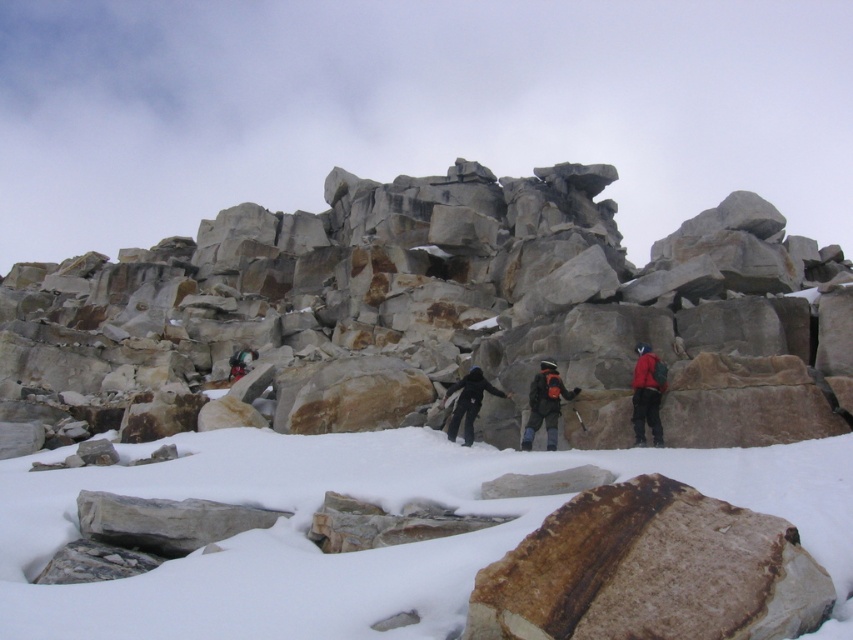
Question: Which object is closer to the camera taking this photo?

Choices:
 (A) white powdery snow at center
 (B) red fabric jacket at center
 (C) black fabric jacket at center

Answer: (A)

Question: Which point appears farthest from the camera in this image?

Choices:
 (A) (738, 252)
 (B) (335, 488)

Answer: (A)

Question: Which point is closer to the camera taking this photo?

Choices:
 (A) (198, 483)
 (B) (144, 385)
 (C) (447, 390)

Answer: (A)

Question: Can you confirm if rustic stone boulders at center is positioned above black fabric jacket at center?

Choices:
 (A) no
 (B) yes

Answer: (B)

Question: Does red fabric jacket at center appear over black fabric jacket at center?

Choices:
 (A) no
 (B) yes

Answer: (B)

Question: Can you confirm if white powdery snow at center is positioned to the left of black fabric jacket at center?

Choices:
 (A) yes
 (B) no

Answer: (A)